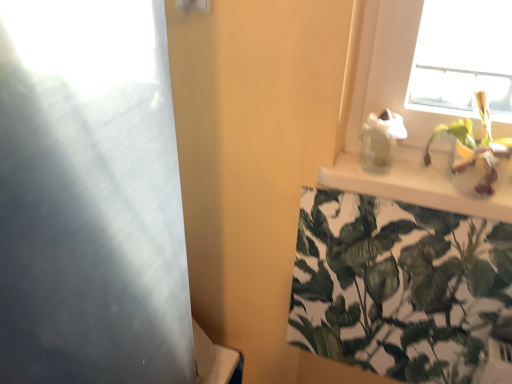
This screenshot has height=384, width=512. What are the coordinates of `green leafy plant at upper right, the second houseplant when ordered from top to bottom` in the screenshot? It's located at (397, 285).

Identify the location of green leafy plant at upper right, which is counted as the 2th houseplant, starting from the bottom. (476, 155).

Can you confirm if green leafy plant at upper right, the second houseplant when ordered from top to bottom, is smaller than transparent glass screen door at left?

Yes, green leafy plant at upper right, the second houseplant when ordered from top to bottom, is smaller than transparent glass screen door at left.

Is green leafy plant at upper right, the second houseplant when ordered from top to bottom, far away from transparent glass screen door at left?

No, green leafy plant at upper right, the second houseplant when ordered from top to bottom, is not far away from transparent glass screen door at left.

From a real-world perspective, which is physically above, green leafy plant at upper right, the second houseplant when ordered from top to bottom, or transparent glass screen door at left?

From a 3D spatial view, transparent glass screen door at left is above.

Can green leafy plant at upper right, the second houseplant when ordered from top to bottom, be found inside green leafy plant at upper right, arranged as the first houseplant when viewed from the top?

Actually, green leafy plant at upper right, the second houseplant when ordered from top to bottom, is outside green leafy plant at upper right, arranged as the first houseplant when viewed from the top.

From their relative heights in the image, would you say green leafy plant at upper right, arranged as the first houseplant when viewed from the top, is taller or shorter than green leafy plant at upper right, the second houseplant when ordered from top to bottom?

Clearly, green leafy plant at upper right, arranged as the first houseplant when viewed from the top, is shorter compared to green leafy plant at upper right, the second houseplant when ordered from top to bottom.

The height and width of the screenshot is (384, 512). Find the location of `houseplant that is in front of the green leafy plant at upper right, the 1th houseplant positioned from the bottom`. houseplant that is in front of the green leafy plant at upper right, the 1th houseplant positioned from the bottom is located at coordinates (476, 155).

Is point (438, 190) positioned behind point (465, 133)?

Yes, it is.

How different are the orientations of white glossy shelf at upper right and green leafy plant at upper right, which is counted as the 2th houseplant, starting from the bottom, in degrees?

The angle between the facing direction of white glossy shelf at upper right and the facing direction of green leafy plant at upper right, which is counted as the 2th houseplant, starting from the bottom, is 2.06 degrees.

The width and height of the screenshot is (512, 384). I want to click on houseplant above the white glossy shelf at upper right (from a real-world perspective), so click(476, 155).

Consider the image. Measure the distance between white glossy shelf at upper right and transparent glass screen door at left.

white glossy shelf at upper right and transparent glass screen door at left are 21.86 inches apart from each other.

Considering the points (437, 200) and (170, 233), which point is in front, point (437, 200) or point (170, 233)?

Positioned in front is point (170, 233).

Locate an element on the screen. screen door in front of the white glossy shelf at upper right is located at coordinates (90, 197).

What's the angular difference between white glossy shelf at upper right and transparent glass screen door at left's facing directions?

They differ by 91.5 degrees in their facing directions.

From the image's perspective, between transparent glass screen door at left and green leafy plant at upper right, the 1th houseplant positioned from the bottom, who is located below?

green leafy plant at upper right, the 1th houseplant positioned from the bottom, from the image's perspective.

Find the location of `screen door in front of the green leafy plant at upper right, the 1th houseplant positioned from the bottom`. screen door in front of the green leafy plant at upper right, the 1th houseplant positioned from the bottom is located at coordinates (90, 197).

Which of these two, transparent glass screen door at left or green leafy plant at upper right, the 1th houseplant positioned from the bottom, stands shorter?

With less height is green leafy plant at upper right, the 1th houseplant positioned from the bottom.

Is transparent glass screen door at left inside or outside of green leafy plant at upper right, the 1th houseplant positioned from the bottom?

transparent glass screen door at left lies outside green leafy plant at upper right, the 1th houseplant positioned from the bottom.

Does white glossy shelf at upper right have a larger size compared to green leafy plant at upper right, the 1th houseplant positioned from the bottom?

Incorrect, white glossy shelf at upper right is not larger than green leafy plant at upper right, the 1th houseplant positioned from the bottom.

From the image's perspective, is white glossy shelf at upper right above or below green leafy plant at upper right, the 1th houseplant positioned from the bottom?

From the image's perspective, white glossy shelf at upper right appears above green leafy plant at upper right, the 1th houseplant positioned from the bottom.

From a real-world perspective, which object stands above the other?

In real-world perspective, white glossy shelf at upper right is above.

Is white glossy shelf at upper right looking in the opposite direction of green leafy plant at upper right, the 1th houseplant positioned from the bottom?

No, white glossy shelf at upper right's orientation is not away from green leafy plant at upper right, the 1th houseplant positioned from the bottom.

Is green leafy plant at upper right, the second houseplant when ordered from top to bottom, wider or thinner than white glossy shelf at upper right?

Considering their sizes, green leafy plant at upper right, the second houseplant when ordered from top to bottom, looks slimmer than white glossy shelf at upper right.

Image resolution: width=512 pixels, height=384 pixels. In the image, there is a green leafy plant at upper right, the 1th houseplant positioned from the bottom. Identify the location of window sill above it (from the image's perspective). (415, 184).

From a real-world perspective, which object stands above the other?

white glossy shelf at upper right is physically above.

You are a GUI agent. You are given a task and a screenshot of the screen. Output one action in this format:
    pyautogui.click(x=<x>, y=<y>)
    Task: Click on the houseplant below the transparent glass screen door at left (from the image's perspective)
    This screenshot has height=384, width=512.
    Given the screenshot: What is the action you would take?
    pyautogui.click(x=397, y=285)

At what (x,y) coordinates should I click in order to perform the action: click on houseplant in front of the green leafy plant at upper right, the second houseplant when ordered from top to bottom. Please return your answer as a coordinate pair (x, y). The width and height of the screenshot is (512, 384). Looking at the image, I should click on (476, 155).

Estimate the real-world distances between objects in this image. Which object is further from white glossy shelf at upper right, transparent glass screen door at left or green leafy plant at upper right, arranged as the first houseplant when viewed from the top?

The object further to white glossy shelf at upper right is transparent glass screen door at left.

Based on their spatial positions, is white glossy shelf at upper right or green leafy plant at upper right, arranged as the first houseplant when viewed from the top, further from transparent glass screen door at left?

The object further to transparent glass screen door at left is green leafy plant at upper right, arranged as the first houseplant when viewed from the top.

Which object lies nearer to the anchor point white glossy shelf at upper right, green leafy plant at upper right, the 1th houseplant positioned from the bottom, or green leafy plant at upper right, which is counted as the 2th houseplant, starting from the bottom?

Based on the image, green leafy plant at upper right, which is counted as the 2th houseplant, starting from the bottom, appears to be nearer to white glossy shelf at upper right.

From the image, which object appears to be nearer to green leafy plant at upper right, which is counted as the 2th houseplant, starting from the bottom, transparent glass screen door at left or white glossy shelf at upper right?

white glossy shelf at upper right.

Looking at the image, which one is located further to green leafy plant at upper right, which is counted as the 2th houseplant, starting from the bottom, white glossy shelf at upper right or transparent glass screen door at left?

transparent glass screen door at left lies further to green leafy plant at upper right, which is counted as the 2th houseplant, starting from the bottom, than the other object.

When comparing their distances from green leafy plant at upper right, the second houseplant when ordered from top to bottom, does white glossy shelf at upper right or transparent glass screen door at left seem closer?

white glossy shelf at upper right lies closer to green leafy plant at upper right, the second houseplant when ordered from top to bottom, than the other object.

When comparing their distances from white glossy shelf at upper right, does green leafy plant at upper right, the second houseplant when ordered from top to bottom, or transparent glass screen door at left seem closer?

The object closer to white glossy shelf at upper right is green leafy plant at upper right, the second houseplant when ordered from top to bottom.

When comparing their distances from white glossy shelf at upper right, does green leafy plant at upper right, which is counted as the 2th houseplant, starting from the bottom, or transparent glass screen door at left seem closer?

green leafy plant at upper right, which is counted as the 2th houseplant, starting from the bottom.

This screenshot has width=512, height=384. What are the coordinates of `window sill between transparent glass screen door at left and green leafy plant at upper right, the second houseplant when ordered from top to bottom, in the horizontal direction` in the screenshot? It's located at (415, 184).

You are a GUI agent. You are given a task and a screenshot of the screen. Output one action in this format:
    pyautogui.click(x=<x>, y=<y>)
    Task: Click on the window sill between green leafy plant at upper right, which is counted as the 2th houseplant, starting from the bottom, and green leafy plant at upper right, the 1th houseplant positioned from the bottom, in the vertical direction
    This screenshot has width=512, height=384.
    Given the screenshot: What is the action you would take?
    pyautogui.click(x=415, y=184)

Find the location of a particular element. The height and width of the screenshot is (384, 512). houseplant between transparent glass screen door at left and green leafy plant at upper right, arranged as the first houseplant when viewed from the top, from left to right is located at coordinates (397, 285).

The width and height of the screenshot is (512, 384). Identify the location of window sill located between transparent glass screen door at left and green leafy plant at upper right, which is counted as the 2th houseplant, starting from the bottom, in the left-right direction. (415, 184).